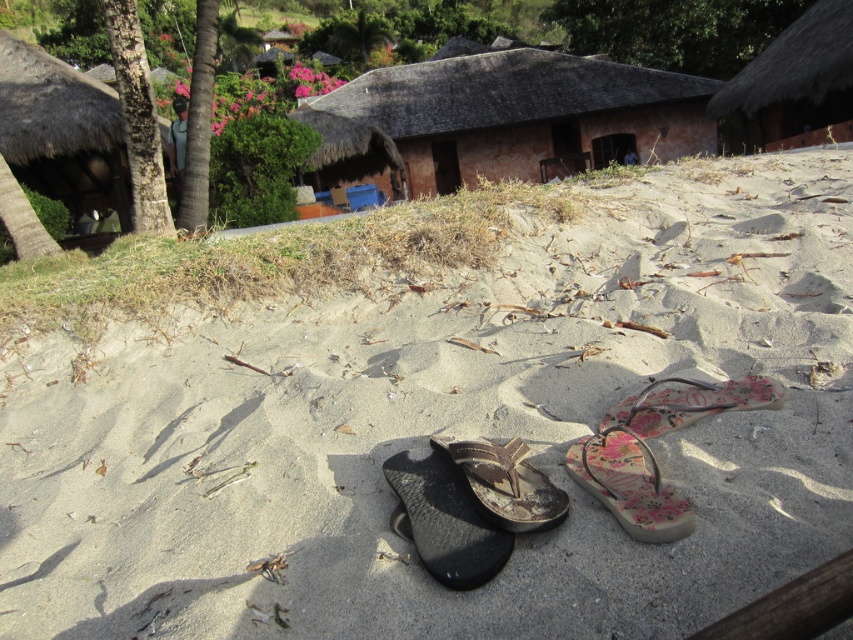
You are standing in front of the sandy area with the two pairs of flip flops. You want to walk towards the thatched roof hut at upper right but need to avoid the thatched roof hut at left. Which direction should you head towards?

The thatched roof hut at left is below the thatched roof hut at upper right, so you should head upwards or to the upper right direction to avoid the lower one and reach your destination.